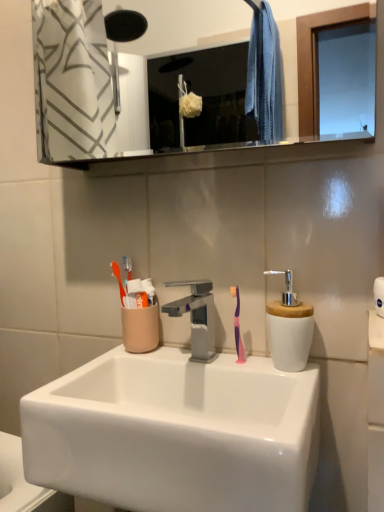
Where is `vacant region to the left of pink rubber toothbrush at center`? vacant region to the left of pink rubber toothbrush at center is located at coordinates (172, 362).